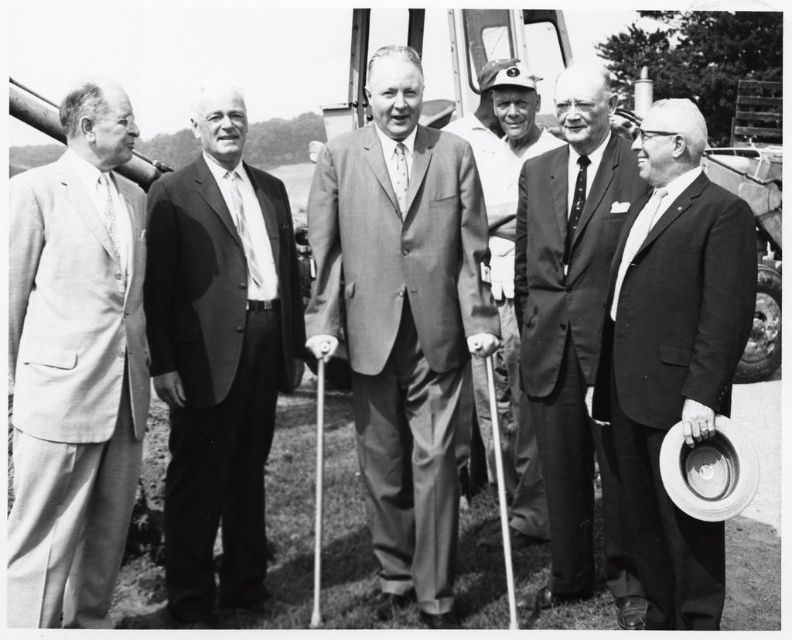
Based on the scene description, where is the matte silk tie at left located in the image?

The matte silk tie at left is located at point (112, 218).